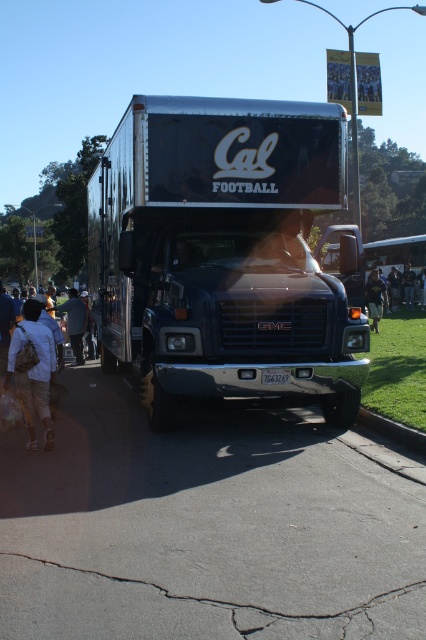
Who is shorter, shiny black truck at center or dark blue uniform at lower right?

Standing shorter between the two is dark blue uniform at lower right.

Describe the element at coordinates (221, 253) in the screenshot. I see `shiny black truck at center` at that location.

You are a GUI agent. You are given a task and a screenshot of the screen. Output one action in this format:
    pyautogui.click(x=<x>, y=<y>)
    Task: Click on the shiny black truck at center
    This screenshot has width=426, height=640.
    Given the screenshot: What is the action you would take?
    pyautogui.click(x=221, y=253)

Is light brown backpack at left to the left of gray concrete curb at lower right from the viewer's perspective?

Correct, you'll find light brown backpack at left to the left of gray concrete curb at lower right.

Is the position of light brown backpack at left less distant than that of gray concrete curb at lower right?

That is False.

This screenshot has width=426, height=640. In order to click on light brown backpack at left in this screenshot , I will do `click(34, 371)`.

Can you confirm if shiny black truck at center is smaller than dark blue shirt at center?

Incorrect, shiny black truck at center is not smaller in size than dark blue shirt at center.

Which is behind, point (164, 400) or point (411, 296)?

Positioned behind is point (411, 296).

At what (x,y) coordinates should I click in order to perform the action: click on shiny black truck at center. Please return your answer as a coordinate pair (x, y). This screenshot has height=640, width=426. Looking at the image, I should click on (221, 253).